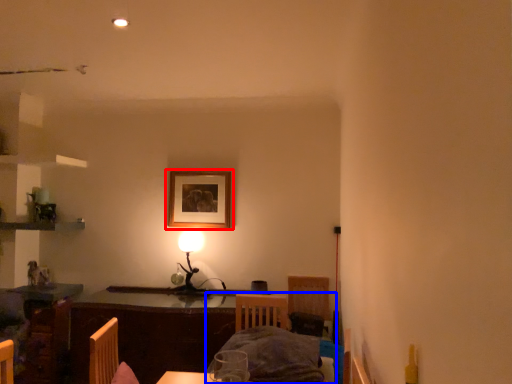
Question: Among these objects, which one is nearest to the camera, picture frame (highlighted by a red box) or bed (highlighted by a blue box)?

Choices:
 (A) picture frame
 (B) bed

Answer: (B)